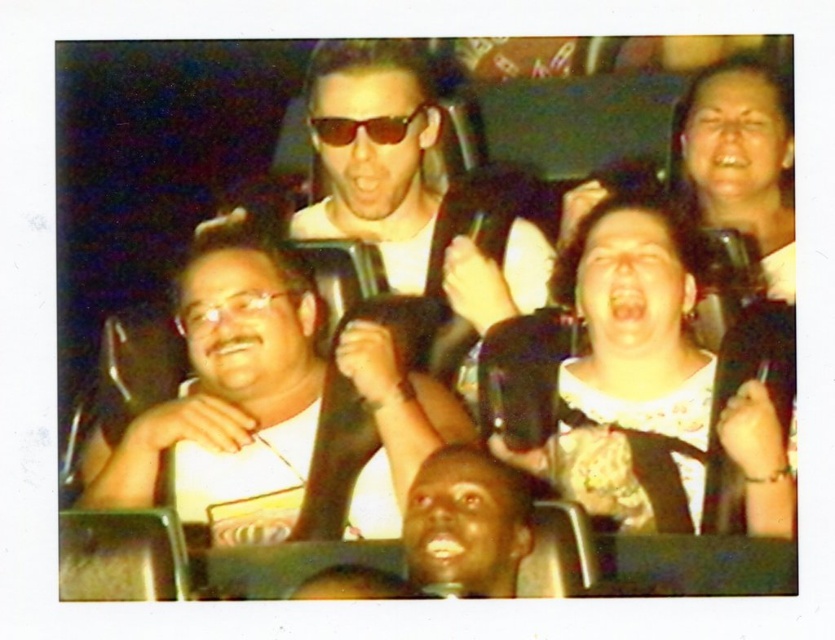
Question: Can you confirm if white lace blouse at center is wider than sunglasses at center?

Choices:
 (A) no
 (B) yes

Answer: (A)

Question: Is white matte shirt at center smaller than shiny black sunglasses at center?

Choices:
 (A) yes
 (B) no

Answer: (B)

Question: Is smooth skin face at lower center to the right of matte black goggles at center from the viewer's perspective?

Choices:
 (A) yes
 (B) no

Answer: (A)

Question: Which point is closer to the camera?

Choices:
 (A) matte black goggles at center
 (B) shiny black sunglasses at center

Answer: (A)

Question: Among these points, which one is nearest to the camera?

Choices:
 (A) (453, 470)
 (B) (209, 484)
 (C) (697, 390)

Answer: (A)

Question: Which point is farther to the camera?

Choices:
 (A) smooth skin face at upper right
 (B) matte black goggles at center
 (C) sunglasses at center
 (D) white lace blouse at center

Answer: (A)